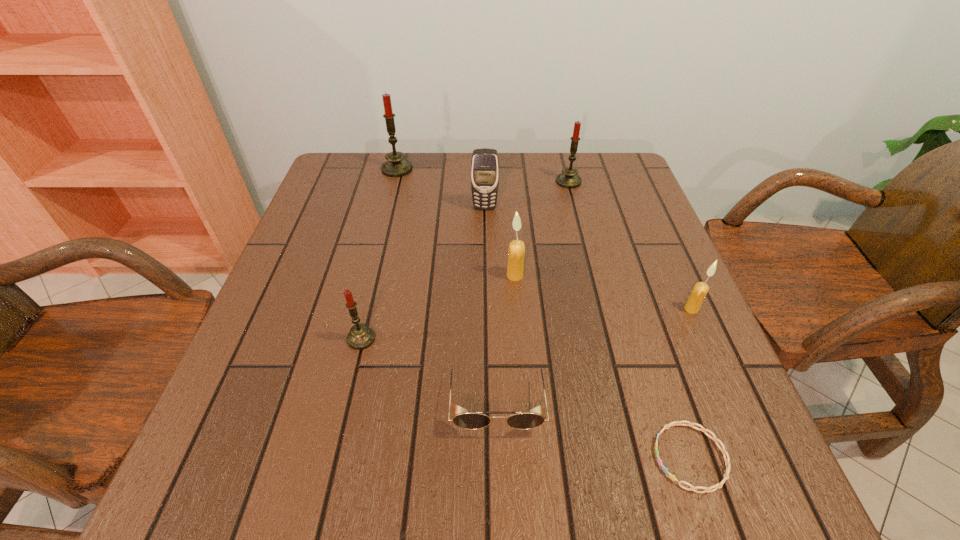
Where is `red candle that is the third closest one to the cellular telephone`? This screenshot has height=540, width=960. red candle that is the third closest one to the cellular telephone is located at coordinates (360, 337).

At what (x,y) coordinates should I click in order to perform the action: click on vacant region that satisfies the following two spatial constraints: 1. on the front side of the rightmost candle; 2. on the right side of the fourth candle from left to right. Please return your answer as a coordinate pair (x, y). Image resolution: width=960 pixels, height=540 pixels. Looking at the image, I should click on (601, 309).

Where is `free space that satisfies the following two spatial constraints: 1. on the front side of the second biggest red candle; 2. on the left side of the tallest object`? free space that satisfies the following two spatial constraints: 1. on the front side of the second biggest red candle; 2. on the left side of the tallest object is located at coordinates pyautogui.click(x=394, y=181).